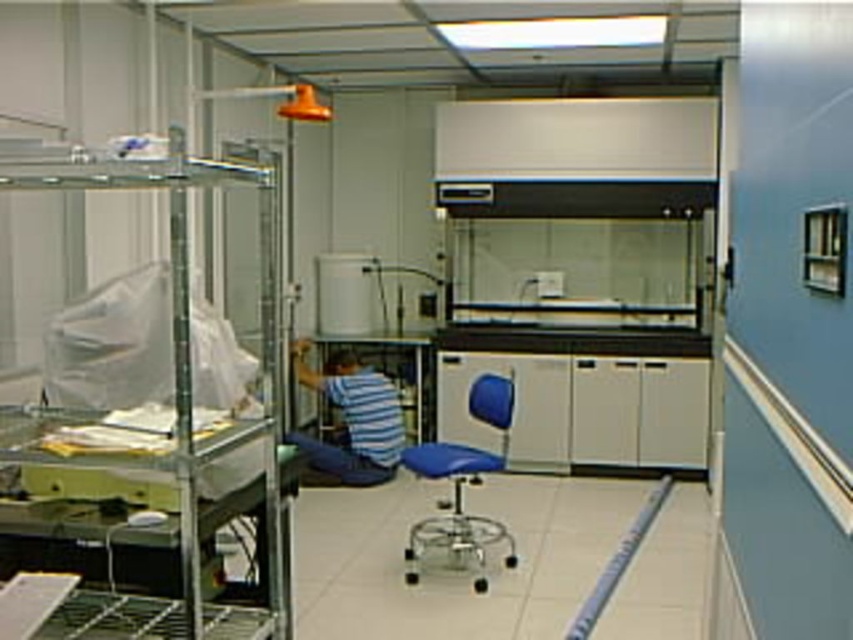
Question: Does blue striped shirt at center appear under blue fabric chair at center?

Choices:
 (A) no
 (B) yes

Answer: (A)

Question: Observing the image, what is the correct spatial positioning of blue striped shirt at center in reference to blue fabric chair at center?

Choices:
 (A) below
 (B) above

Answer: (B)

Question: Which of the following is the closest to the observer?

Choices:
 (A) blue fabric chair at center
 (B) blue striped shirt at center

Answer: (A)

Question: Which point is closer to the camera?

Choices:
 (A) blue striped shirt at center
 (B) blue fabric chair at center

Answer: (B)

Question: Can you confirm if blue striped shirt at center is positioned below blue fabric chair at center?

Choices:
 (A) no
 (B) yes

Answer: (A)